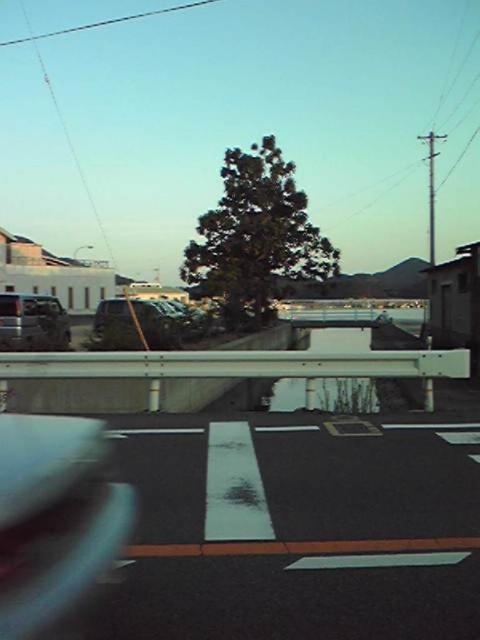
You are a delivery driver navigating a road with a concrete barrier in the center. You see a metallic silver car at center. Based on its position, can you estimate whether it is driving on the left or right side of the road?

The metallic silver car at center is positioned at point (135, 324). Since the concrete barrier is in the middle of the road, the car is likely driving on the right side of the road.

Based on the coordinates provided, which object is located at point (135, 324) in the image?

The metallic silver car at center is located at point (135, 324).

You are a pedestrian standing at the edge of the road. You see the metallic silver suv at left and the transparent glass car window at lower left. Which object is wider from your perspective?

The metallic silver suv at left is wider than the transparent glass car window at lower left.